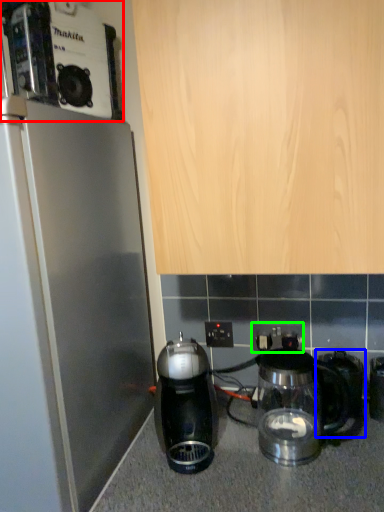
Question: Which is farther away from coffee maker (highlighted by a red box)? coffeepot (highlighted by a blue box) or electric outlet (highlighted by a green box)?

Choices:
 (A) coffeepot
 (B) electric outlet

Answer: (A)